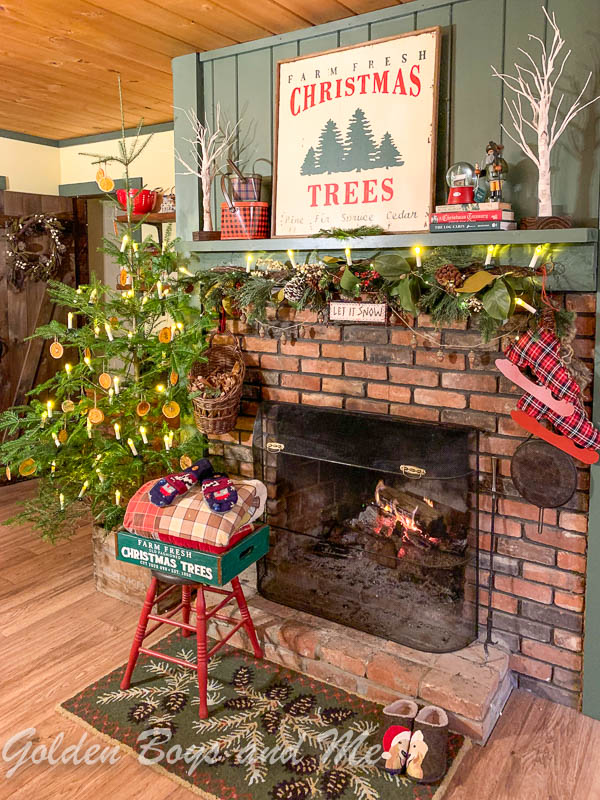
Find the location of a particular element. red wooden stool legs is located at coordinates (147, 602), (201, 641), (249, 630), (184, 598).